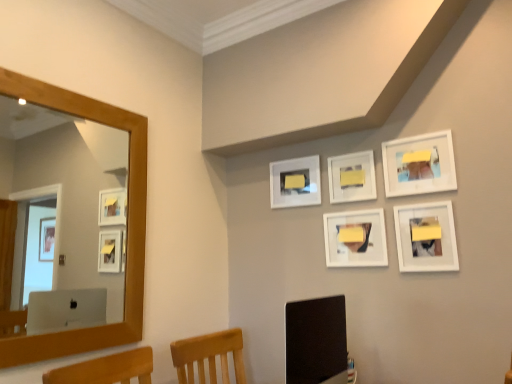
Question: From a real-world perspective, relative to white matte picture frame at upper center, the fifth picture frame viewed from the right, is white matte picture frame at upper right, acting as the fourth picture frame starting from the left, vertically above or below?

Choices:
 (A) below
 (B) above

Answer: (A)

Question: Is white matte picture frame at upper right, acting as the fourth picture frame starting from the left, bigger or smaller than white matte picture frame at upper center, which is the first picture frame in left-to-right order?

Choices:
 (A) big
 (B) small

Answer: (A)

Question: Which object is the farthest from the white matte picture frame at center, arranged as the third picture frame when viewed from the right?

Choices:
 (A) matte black monitor at lower center
 (B) white matte picture frame at upper center, which is the first picture frame in left-to-right order
 (C) white matte picture frame at center, which is the 2th picture frame from left to right
 (D) white matte picture frame at upper right, which is the 2th picture frame in right-to-left order
 (E) white matte picture frame at lower right, the 5th picture frame viewed from the left

Answer: (A)

Question: Estimate the real-world distances between objects in this image. Which object is farther from the white matte picture frame at upper center, the fifth picture frame viewed from the right?

Choices:
 (A) white matte picture frame at lower right, the 5th picture frame viewed from the left
 (B) white matte picture frame at upper right, which is the 2th picture frame in right-to-left order
 (C) white matte picture frame at center, which is the 2th picture frame from left to right
 (D) wooden mirror at left
 (E) matte black monitor at lower center

Answer: (D)